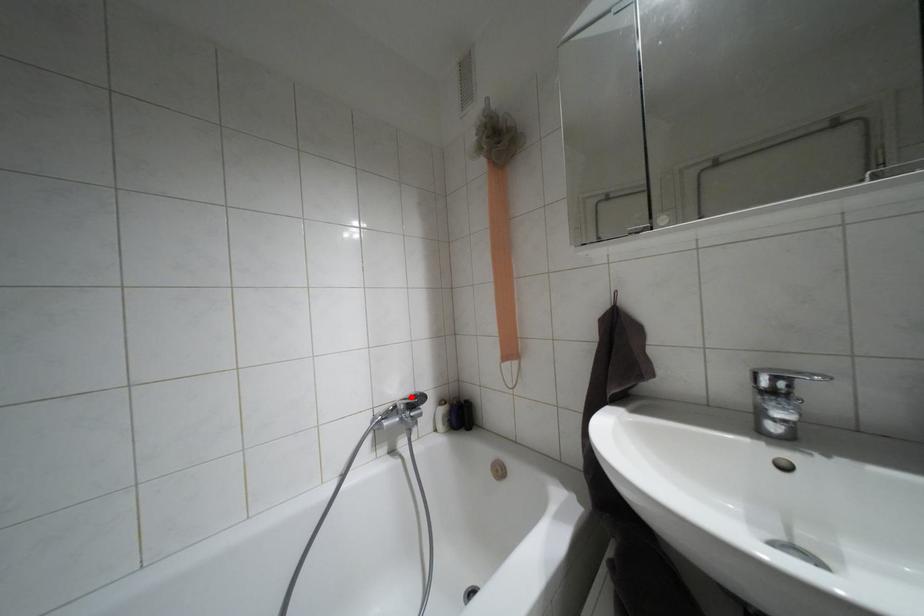
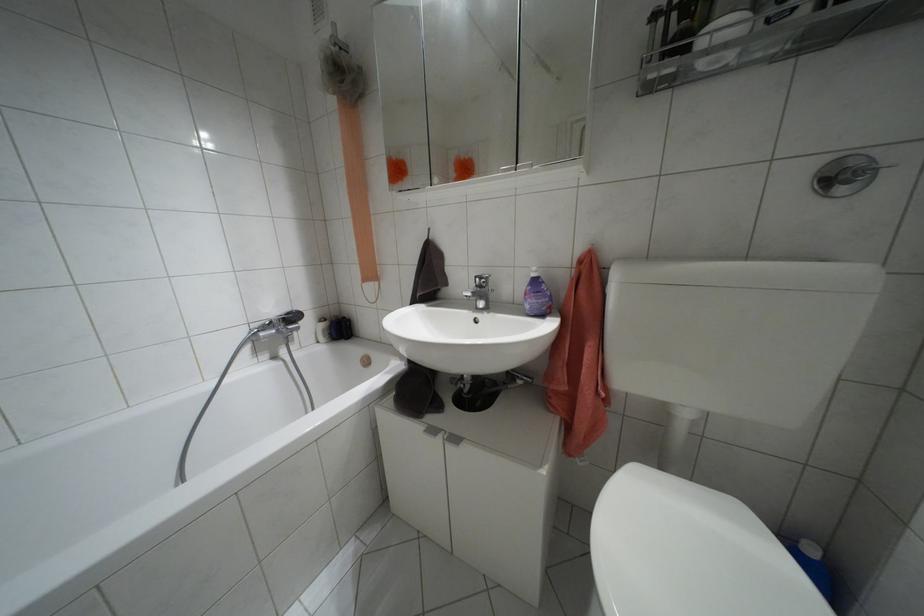
Question: I am providing you with two images of the same scene from different viewpoints. Given a red point in image1, look at the same physical point in image2. Is it:

Choices:
 (A) Closer to the viewpoint
 (B) Farther from the viewpoint

Answer: (A)